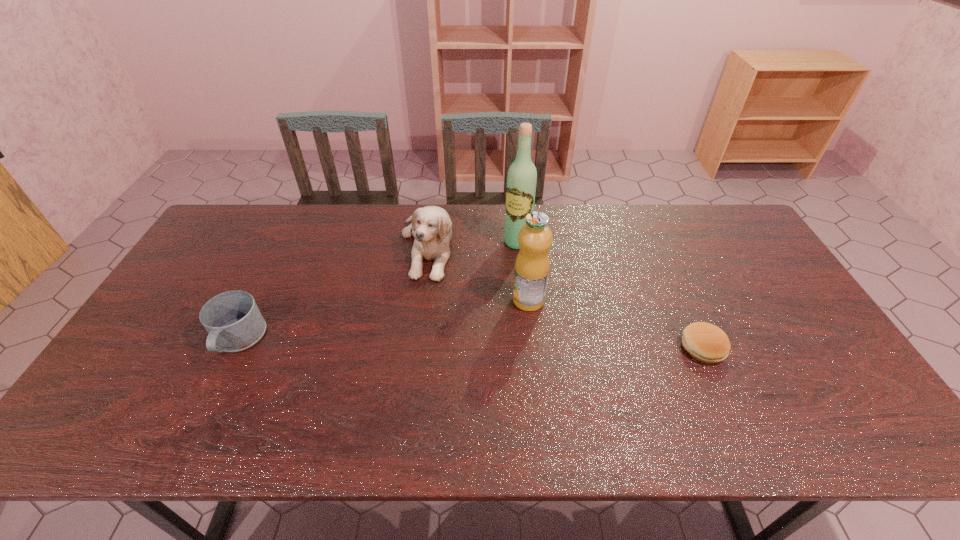
Find the location of a particular element. Image resolution: width=960 pixels, height=540 pixels. vacant space on the desktop that is between the second shortest object and the patty and is positioned on the front-facing side of the second object from left to right is located at coordinates (438, 343).

Find the location of a particular element. free spot on the desktop that is between the fourth tallest object and the rightmost object and is positioned on the front label of the third farthest object is located at coordinates (482, 344).

The width and height of the screenshot is (960, 540). Identify the location of vacant space on the desktop that is between the leftmost object and the rightmost object and is positioned on the front-facing side of the tallest object. (446, 343).